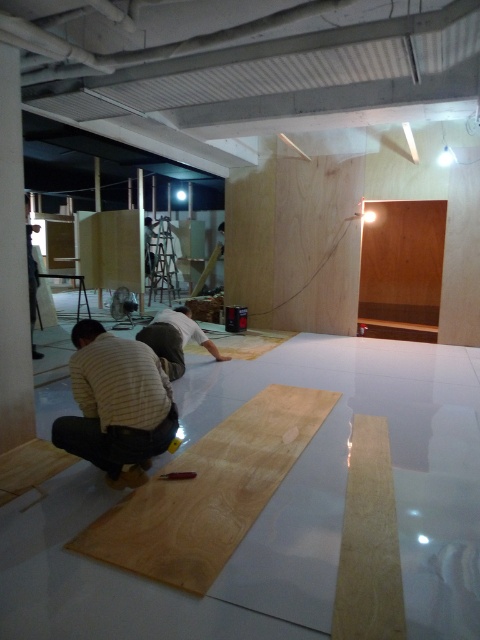
Question: Can you confirm if striped cotton shirt at lower left is smaller than light brown wood plank at center?

Choices:
 (A) yes
 (B) no

Answer: (A)

Question: Which of the following is the closest to the observer?

Choices:
 (A) (384, 468)
 (B) (178, 476)

Answer: (B)

Question: Which point appears closest to the camera in this image?

Choices:
 (A) (312, 401)
 (B) (360, 632)
 (C) (176, 476)

Answer: (B)

Question: In this image, where is striped cotton shirt at lower left located relative to light brown wood plank at center?

Choices:
 (A) right
 (B) left

Answer: (B)

Question: Can you confirm if light wood plank at center is thinner than wooden plank at center?

Choices:
 (A) yes
 (B) no

Answer: (B)

Question: Which of the following is the farthest from the observer?

Choices:
 (A) (156, 449)
 (B) (188, 472)
 (C) (356, 534)
 (D) (274, 426)

Answer: (D)